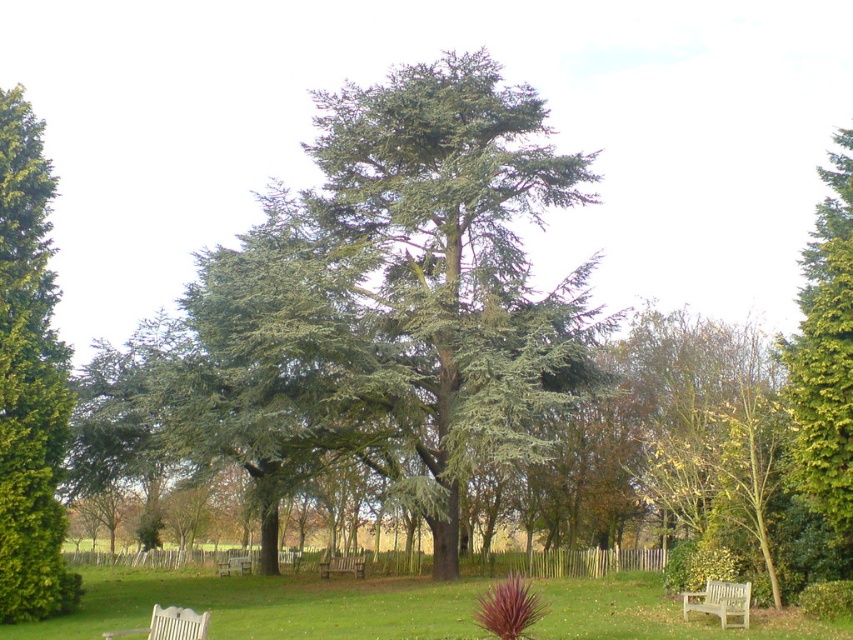
You are standing in the park and want to walk from the point at coordinates point (276, 557) to the point at coordinates point (840, 305). Which direction should you move to get closer to your destination?

To move from point (276, 557) to point (840, 305), you should move upward and to the left because point (840, 305) is located above and to the left of point (276, 557).